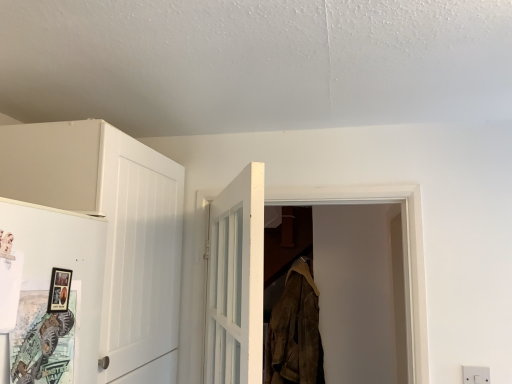
Question: From the image's perspective, is matte black picture frame at left located above white plastic electric outlet at lower right?

Choices:
 (A) yes
 (B) no

Answer: (A)

Question: Does matte black picture frame at left appear on the right side of white plastic electric outlet at lower right?

Choices:
 (A) yes
 (B) no

Answer: (B)

Question: From a real-world perspective, is matte black picture frame at left below white plastic electric outlet at lower right?

Choices:
 (A) yes
 (B) no

Answer: (B)

Question: Is matte black picture frame at left touching white plastic electric outlet at lower right?

Choices:
 (A) yes
 (B) no

Answer: (B)

Question: Can you confirm if matte black picture frame at left is taller than white plastic electric outlet at lower right?

Choices:
 (A) yes
 (B) no

Answer: (A)

Question: Is matte black picture frame at left bigger than white plastic electric outlet at lower right?

Choices:
 (A) no
 (B) yes

Answer: (A)

Question: Can you confirm if white matte cabinet at left is wider than white plastic electric outlet at lower right?

Choices:
 (A) no
 (B) yes

Answer: (B)

Question: From a real-world perspective, is white matte cabinet at left on white plastic electric outlet at lower right?

Choices:
 (A) no
 (B) yes

Answer: (B)

Question: Is white matte cabinet at left turned away from white plastic electric outlet at lower right?

Choices:
 (A) no
 (B) yes

Answer: (A)

Question: From the image's perspective, is white matte cabinet at left beneath white plastic electric outlet at lower right?

Choices:
 (A) no
 (B) yes

Answer: (A)

Question: From a real-world perspective, is white matte cabinet at left located beneath white plastic electric outlet at lower right?

Choices:
 (A) no
 (B) yes

Answer: (A)

Question: Does white matte cabinet at left lie in front of white plastic electric outlet at lower right?

Choices:
 (A) no
 (B) yes

Answer: (B)

Question: Is white plastic electric outlet at lower right oriented towards brown suede jacket at center?

Choices:
 (A) no
 (B) yes

Answer: (A)